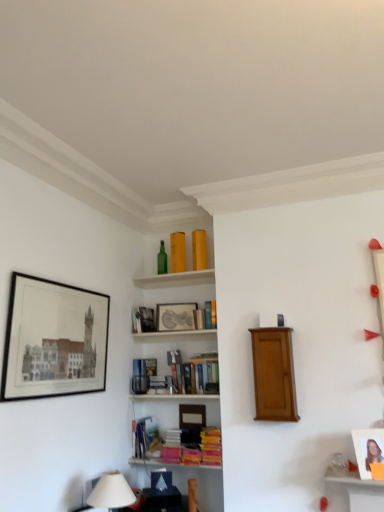
Question: Is hardcover book at upper center, arranged as the 1th book when viewed from the top, not within hardcover book at center, the 3th book positioned from the bottom?

Choices:
 (A) yes
 (B) no

Answer: (A)

Question: Is hardcover book at upper center, marked as the 4th book in a bottom-to-top arrangement, at the left side of hardcover book at center, the 3th book positioned from the bottom?

Choices:
 (A) yes
 (B) no

Answer: (B)

Question: Can you confirm if hardcover book at upper center, arranged as the 1th book when viewed from the top, is thinner than hardcover book at center, the 3th book positioned from the bottom?

Choices:
 (A) no
 (B) yes

Answer: (B)

Question: From the image's perspective, does hardcover book at upper center, arranged as the 1th book when viewed from the top, appear lower than hardcover book at center, placed as the 2th book when sorted from top to bottom?

Choices:
 (A) no
 (B) yes

Answer: (A)

Question: Does hardcover book at upper center, marked as the 4th book in a bottom-to-top arrangement, appear on the right side of hardcover book at center, placed as the 2th book when sorted from top to bottom?

Choices:
 (A) yes
 (B) no

Answer: (A)

Question: In terms of width, does hardcover book at center, placed as the 2th book when sorted from top to bottom, look wider or thinner when compared to matte black picture frame at upper left, which ranks as the first picture frame in front-to-back order?

Choices:
 (A) thin
 (B) wide

Answer: (B)

Question: Is hardcover book at center, placed as the 2th book when sorted from top to bottom, in front of or behind matte black picture frame at upper left, acting as the first picture frame starting from the left, in the image?

Choices:
 (A) front
 (B) behind

Answer: (B)

Question: Based on their positions, is hardcover book at center, the 3th book positioned from the bottom, located to the left or right of matte black picture frame at upper left, placed as the third picture frame when sorted from right to left?

Choices:
 (A) right
 (B) left

Answer: (A)

Question: In terms of height, does hardcover book at center, the 3th book positioned from the bottom, look taller or shorter compared to matte black picture frame at upper left, the third picture frame viewed from the back?

Choices:
 (A) short
 (B) tall

Answer: (A)

Question: In terms of height, does hardcover book at center, placed as the 2th book when sorted from top to bottom, look taller or shorter compared to hardcover book at center, marked as the 3th book in a top-to-bottom arrangement?

Choices:
 (A) short
 (B) tall

Answer: (B)

Question: Considering the positions of point (198, 392) and point (132, 366), is point (198, 392) closer or farther from the camera than point (132, 366)?

Choices:
 (A) closer
 (B) farther

Answer: (A)

Question: Considering the positions of hardcover book at center, placed as the 2th book when sorted from top to bottom, and hardcover book at center, the 2th book ordered from the bottom, in the image, is hardcover book at center, placed as the 2th book when sorted from top to bottom, wider or thinner than hardcover book at center, the 2th book ordered from the bottom,?

Choices:
 (A) wide
 (B) thin

Answer: (A)

Question: From the image's perspective, is hardcover book at center, the 3th book positioned from the bottom, above or below hardcover book at center, marked as the 3th book in a top-to-bottom arrangement?

Choices:
 (A) above
 (B) below

Answer: (A)

Question: Is hardcover book at lower center, acting as the fourth book starting from the top, bigger or smaller than mahogany wood cabinet at center?

Choices:
 (A) small
 (B) big

Answer: (A)

Question: Looking at their shapes, would you say hardcover book at lower center, acting as the fourth book starting from the top, is wider or thinner than mahogany wood cabinet at center?

Choices:
 (A) thin
 (B) wide

Answer: (B)